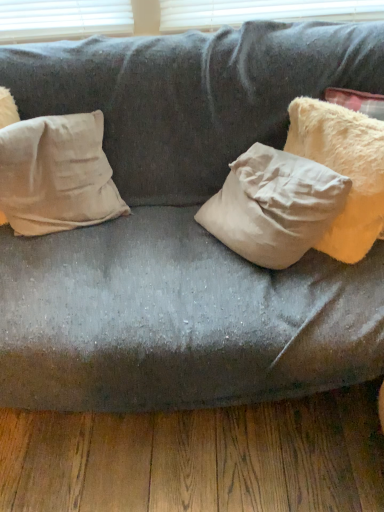
Question: From a real-world perspective, is fuzzy cream pillow at right, acting as the first pillow starting from the right, positioned under beige cotton pillow at left, which appears as the 1th pillow when viewed from the left, based on gravity?

Choices:
 (A) no
 (B) yes

Answer: (A)

Question: From a real-world perspective, is fuzzy cream pillow at right, acting as the first pillow starting from the right, over beige cotton pillow at left, which is the second pillow in right-to-left order?

Choices:
 (A) no
 (B) yes

Answer: (B)

Question: Considering the relative positions of fuzzy cream pillow at right, acting as the first pillow starting from the right, and beige cotton pillow at left, which appears as the 1th pillow when viewed from the left, in the image provided, is fuzzy cream pillow at right, acting as the first pillow starting from the right, to the left of beige cotton pillow at left, which appears as the 1th pillow when viewed from the left, from the viewer's perspective?

Choices:
 (A) yes
 (B) no

Answer: (B)

Question: Does fuzzy cream pillow at right, acting as the first pillow starting from the right, have a larger size compared to beige cotton pillow at left, which is the second pillow in right-to-left order?

Choices:
 (A) no
 (B) yes

Answer: (B)

Question: Does fuzzy cream pillow at right, acting as the 2th pillow starting from the left, lie in front of beige cotton pillow at left, which appears as the 1th pillow when viewed from the left?

Choices:
 (A) no
 (B) yes

Answer: (B)

Question: Is fuzzy cream pillow at right, acting as the 2th pillow starting from the left, at the right side of beige cotton pillow at left, which appears as the 1th pillow when viewed from the left?

Choices:
 (A) no
 (B) yes

Answer: (B)

Question: Can you confirm if beige cotton pillow at left, which appears as the 1th pillow when viewed from the left, is positioned to the right of fuzzy cream pillow at right, acting as the first pillow starting from the right?

Choices:
 (A) yes
 (B) no

Answer: (B)

Question: Is beige cotton pillow at left, which is the second pillow in right-to-left order, shorter than fuzzy cream pillow at right, acting as the first pillow starting from the right?

Choices:
 (A) no
 (B) yes

Answer: (B)

Question: Does beige cotton pillow at left, which is the second pillow in right-to-left order, have a greater width compared to fuzzy cream pillow at right, acting as the first pillow starting from the right?

Choices:
 (A) no
 (B) yes

Answer: (A)

Question: Is beige cotton pillow at left, which is the second pillow in right-to-left order, located outside fuzzy cream pillow at right, acting as the 2th pillow starting from the left?

Choices:
 (A) no
 (B) yes

Answer: (B)

Question: Does beige cotton pillow at left, which appears as the 1th pillow when viewed from the left, have a greater height compared to fuzzy cream pillow at right, acting as the first pillow starting from the right?

Choices:
 (A) no
 (B) yes

Answer: (A)

Question: From the image's perspective, is beige cotton pillow at left, which is the second pillow in right-to-left order, above fuzzy cream pillow at right, acting as the first pillow starting from the right?

Choices:
 (A) no
 (B) yes

Answer: (A)

Question: Is point (306, 112) positioned closer to the camera than point (87, 140)?

Choices:
 (A) closer
 (B) farther

Answer: (A)